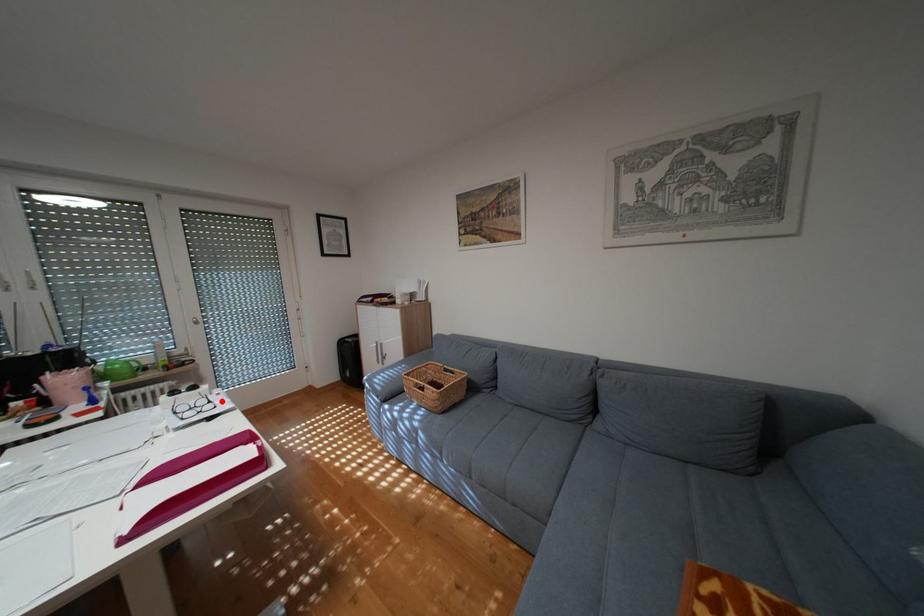
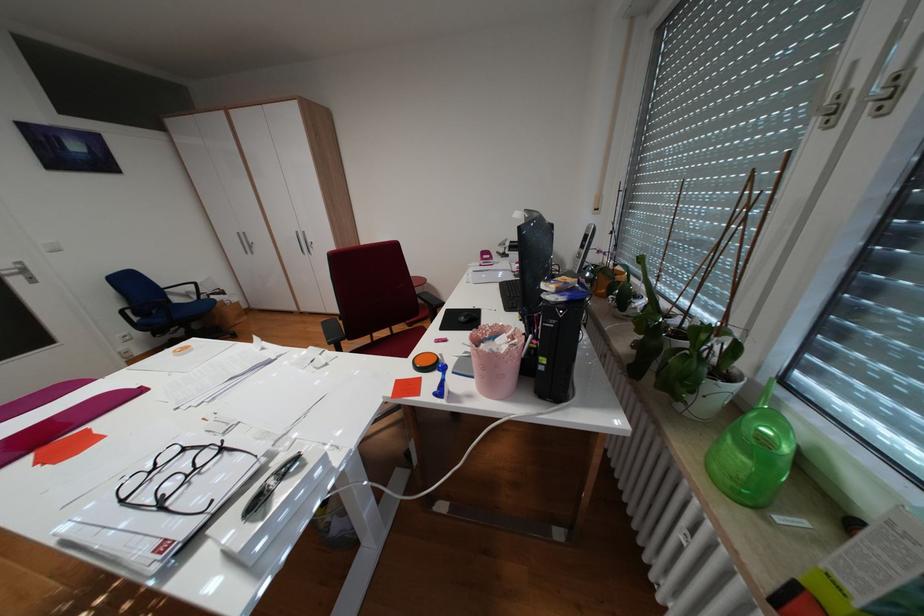
In the second image, find the point that corresponds to the highlighted location in the first image.

(173, 505)